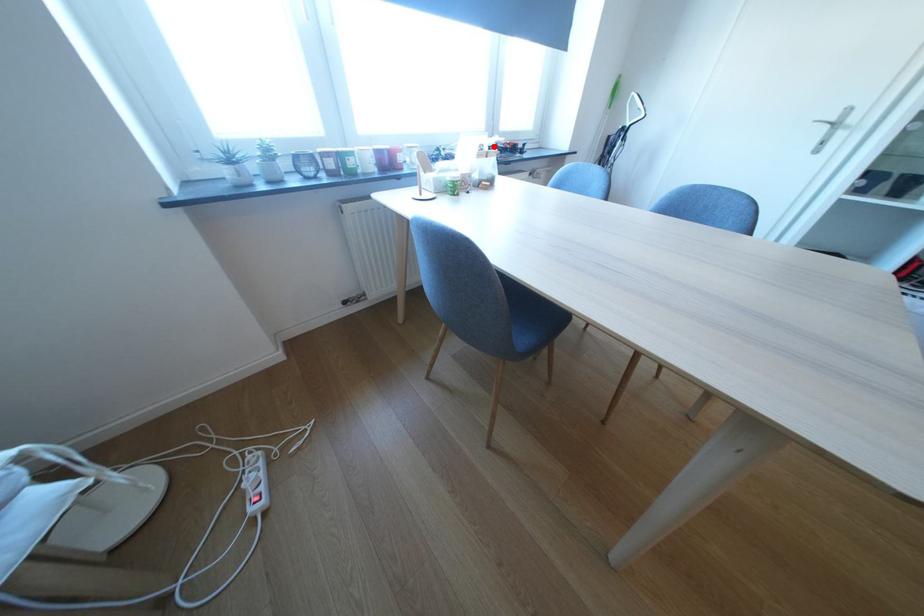
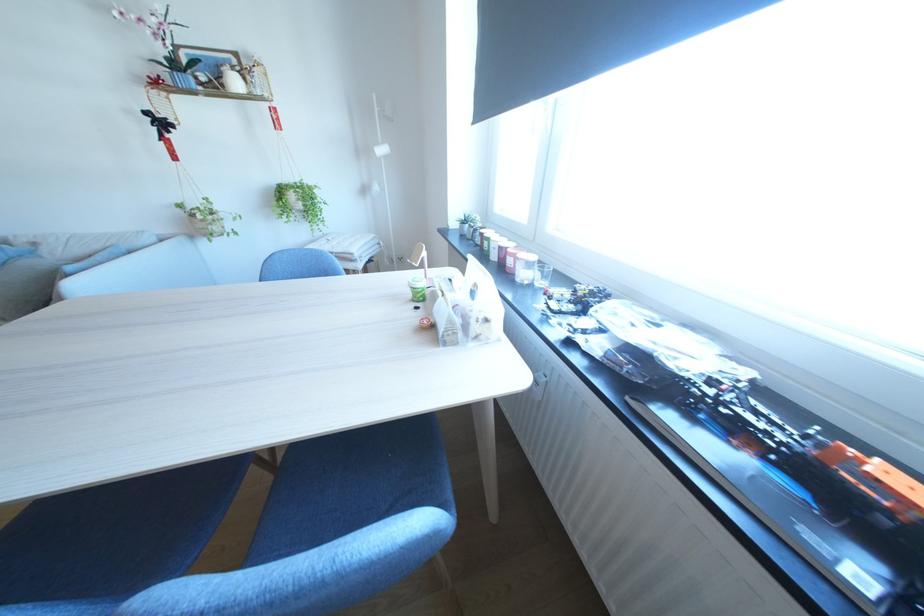
Question: I am providing you with two images of the same scene from different viewpoints. Given a red point in image1, look at the same physical point in image2. Is it:

Choices:
 (A) Closer to the viewpoint
 (B) Farther from the viewpoint

Answer: (B)